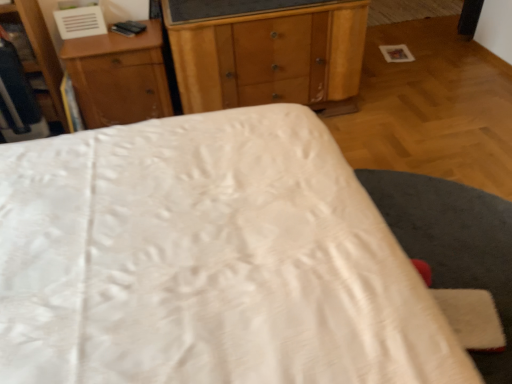
Question: Can you confirm if white satin bed at center is smaller than wooden dresser at left?

Choices:
 (A) yes
 (B) no

Answer: (B)

Question: From the image's perspective, is white satin bed at center on top of wooden dresser at left?

Choices:
 (A) yes
 (B) no

Answer: (B)

Question: Can you confirm if white satin bed at center is thinner than wooden dresser at left?

Choices:
 (A) yes
 (B) no

Answer: (B)

Question: From the image's perspective, would you say white satin bed at center is shown under wooden dresser at left?

Choices:
 (A) no
 (B) yes

Answer: (B)

Question: Could you tell me if white satin bed at center is facing wooden dresser at left?

Choices:
 (A) no
 (B) yes

Answer: (A)

Question: From the image's perspective, is wooden chest of drawers at center above or below white satin bed at center?

Choices:
 (A) above
 (B) below

Answer: (A)

Question: Considering their positions, is wooden chest of drawers at center located in front of or behind white satin bed at center?

Choices:
 (A) front
 (B) behind

Answer: (B)

Question: Would you say wooden chest of drawers at center is to the left or to the right of white satin bed at center in the picture?

Choices:
 (A) right
 (B) left

Answer: (A)

Question: From a real-world perspective, is wooden chest of drawers at center positioned above or below white satin bed at center?

Choices:
 (A) below
 (B) above

Answer: (A)

Question: From the image's perspective, is white satin bed at center located above or below wooden chest of drawers at center?

Choices:
 (A) below
 (B) above

Answer: (A)

Question: In the image, is white satin bed at center positioned in front of or behind wooden chest of drawers at center?

Choices:
 (A) front
 (B) behind

Answer: (A)

Question: Visually, is white satin bed at center positioned to the left or to the right of wooden chest of drawers at center?

Choices:
 (A) right
 (B) left

Answer: (B)

Question: In terms of width, does white satin bed at center look wider or thinner when compared to wooden chest of drawers at center?

Choices:
 (A) wide
 (B) thin

Answer: (A)

Question: Relative to wooden nightstand at upper center, is wooden dresser at left in front or behind?

Choices:
 (A) behind
 (B) front

Answer: (B)

Question: From the image's perspective, relative to wooden nightstand at upper center, is wooden dresser at left above or below?

Choices:
 (A) below
 (B) above

Answer: (A)